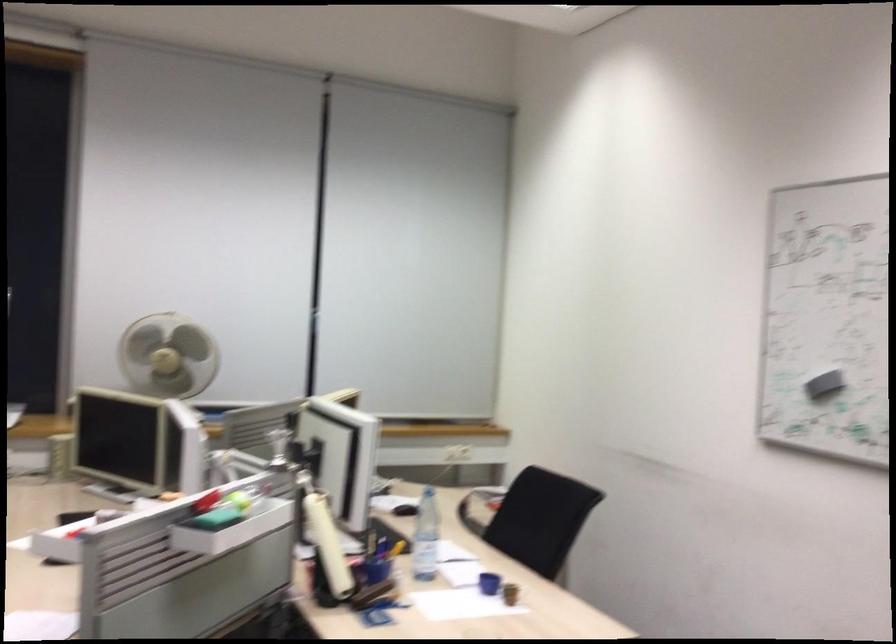
Find where to lift the blue cup. Please return your answer as a coordinate pair (x, y).

(488, 583)